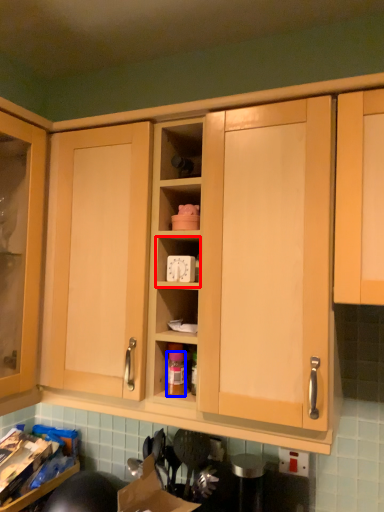
Question: Which object appears farthest to the camera in this image, cabinet (highlighted by a red box) or bottle (highlighted by a blue box)?

Choices:
 (A) cabinet
 (B) bottle

Answer: (B)